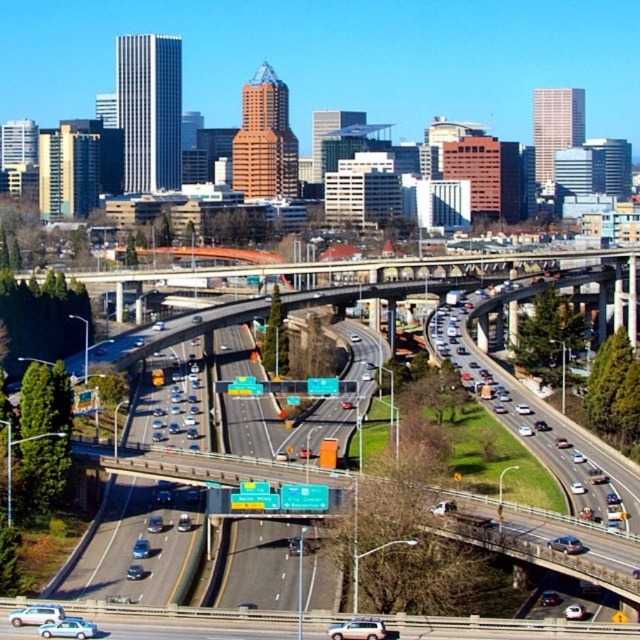
From the picture: You are standing at the viewpoint of the image and see two points marked on the highway system. Which point is nearer to you, point (x=65, y=618) or point (x=564, y=545)?

Point (x=65, y=618) is closer to the viewer than point (x=564, y=545).

You are a traffic controller observing the highway system. There is a silver metallic sedan at center that needs to exit the highway. The exit ramp is located at point (566, 545). Can you determine the direction the sedan should turn to reach the exit?

The point (566, 545) indicates the silver metallic sedan at center, so the sedan is already at the exit. No turn is needed.

You are a pedestrian trying to cross the road in the urban scene. You see a silver metallic sedan at center and a white glossy sedan at center. Which car should you avoid stepping in front of if you want to cross safely?

You should avoid stepping in front of both the silver metallic sedan at center and the white glossy sedan at center because they are in motion on the road, and crossing in front of moving vehicles is dangerous. Ensure you use a crosswalk or wait for a safe opportunity to cross when there is no oncoming traffic.